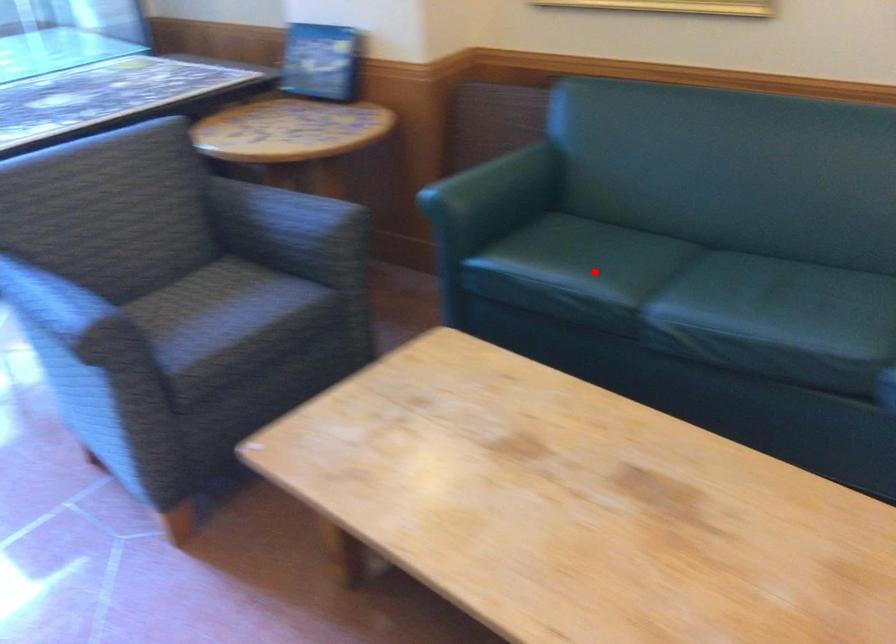
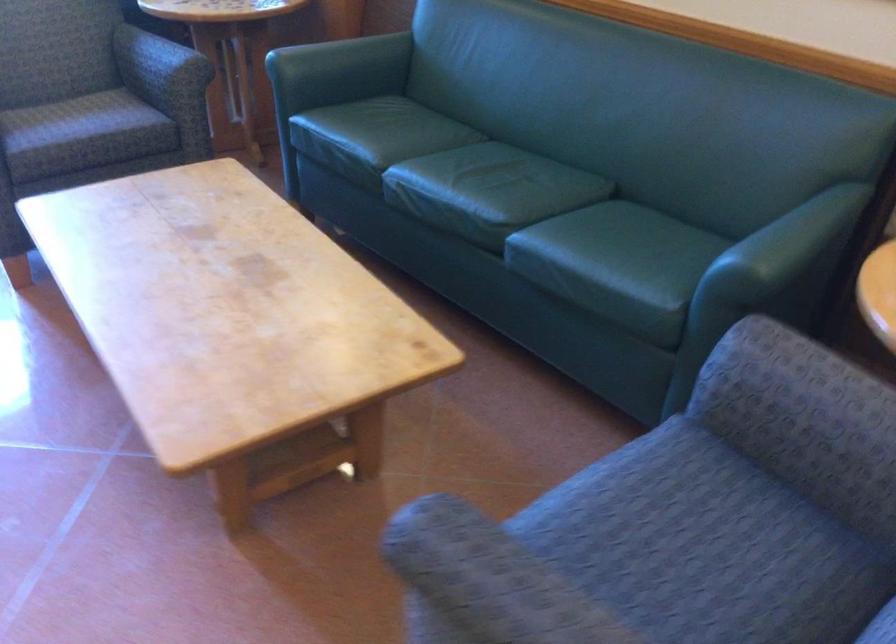
Find the pixel in the second image that matches the highlighted location in the first image.

(374, 137)